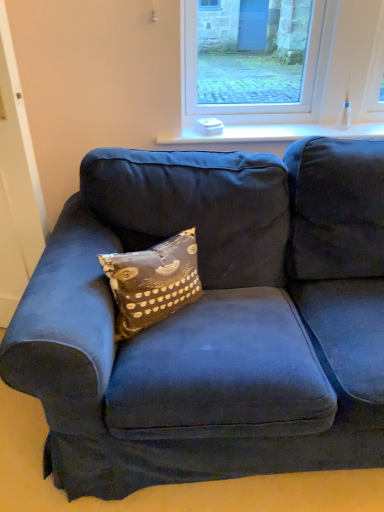
The image size is (384, 512). What do you see at coordinates (271, 134) in the screenshot?
I see `white glossy window sill at upper center` at bounding box center [271, 134].

Image resolution: width=384 pixels, height=512 pixels. Describe the element at coordinates (153, 282) in the screenshot. I see `brown printed cushion at center` at that location.

Identify the location of white glossy window sill at upper center. (271, 134).

From the image's perspective, is brown printed cushion at center on white glossy window sill at upper center?

No, from the image's perspective, brown printed cushion at center is not above white glossy window sill at upper center.

Can white glossy window sill at upper center be found inside brown printed cushion at center?

No.

Based on the photo, from their relative heights in the image, would you say brown printed cushion at center is taller or shorter than white glossy window sill at upper center?

Clearly, brown printed cushion at center is taller compared to white glossy window sill at upper center.

You are a GUI agent. You are given a task and a screenshot of the screen. Output one action in this format:
    pyautogui.click(x=<x>, y=<y>)
    Task: Click on the pillow below the white glossy window sill at upper center (from the image's perspective)
    
    Given the screenshot: What is the action you would take?
    (x=153, y=282)

Looking at this image, which is correct: white glossy window sill at upper center is inside clear glass window at upper center, or outside of it?

white glossy window sill at upper center is located beyond the bounds of clear glass window at upper center.

The width and height of the screenshot is (384, 512). In order to click on window above the white glossy window sill at upper center (from a real-world perspective) in this screenshot , I will do `click(256, 65)`.

Does white glossy window sill at upper center have a larger size compared to clear glass window at upper center?

Incorrect, white glossy window sill at upper center is not larger than clear glass window at upper center.

In terms of height, does white glossy window sill at upper center look taller or shorter compared to clear glass window at upper center?

Clearly, white glossy window sill at upper center is shorter compared to clear glass window at upper center.

Is clear glass window at upper center directly adjacent to brown printed cushion at center?

No, clear glass window at upper center is not beside brown printed cushion at center.

Considering the sizes of clear glass window at upper center and brown printed cushion at center in the image, is clear glass window at upper center wider or thinner than brown printed cushion at center?

Clearly, clear glass window at upper center has less width compared to brown printed cushion at center.

Can brown printed cushion at center be found inside clear glass window at upper center?

No.

Identify the location of window located above the brown printed cushion at center (from a real-world perspective). The image size is (384, 512). (256, 65).

Does brown printed cushion at center have a lesser height compared to clear glass window at upper center?

Indeed, brown printed cushion at center has a lesser height compared to clear glass window at upper center.

From a real-world perspective, is brown printed cushion at center beneath clear glass window at upper center?

Indeed, from a real-world perspective, brown printed cushion at center is positioned beneath clear glass window at upper center.

In the scene shown: Is brown printed cushion at center next to clear glass window at upper center and touching it?

brown printed cushion at center is not next to clear glass window at upper center, and they're not touching.

Is clear glass window at upper center at the back of brown printed cushion at center?

No, brown printed cushion at center's orientation is not away from clear glass window at upper center.

How many degrees apart are the facing directions of clear glass window at upper center and white glossy window sill at upper center?

0.806 degrees separate the facing orientations of clear glass window at upper center and white glossy window sill at upper center.

Considering the sizes of clear glass window at upper center and white glossy window sill at upper center in the image, is clear glass window at upper center taller or shorter than white glossy window sill at upper center?

In the image, clear glass window at upper center appears to be taller than white glossy window sill at upper center.

There is a white glossy window sill at upper center. In order to click on window above it (from a real-world perspective) in this screenshot , I will do `click(256, 65)`.

From a real-world perspective, who is located lower, clear glass window at upper center or white glossy window sill at upper center?

white glossy window sill at upper center, from a real-world perspective.

From the image's perspective, which is below, white glossy window sill at upper center or brown printed cushion at center?

brown printed cushion at center appears lower in the image.

In the scene shown: Does white glossy window sill at upper center lie behind brown printed cushion at center?

That is True.

In terms of height, does white glossy window sill at upper center look taller or shorter compared to brown printed cushion at center?

In the image, white glossy window sill at upper center appears to be shorter than brown printed cushion at center.

From a real-world perspective, is white glossy window sill at upper center below brown printed cushion at center?

No, from a real-world perspective, white glossy window sill at upper center is not under brown printed cushion at center.

This screenshot has width=384, height=512. I want to click on pillow beneath the white glossy window sill at upper center (from a real-world perspective), so click(x=153, y=282).

I want to click on window sill that is behind the clear glass window at upper center, so click(271, 134).

In the scene shown: Based on their spatial positions, is brown printed cushion at center or white glossy window sill at upper center further from clear glass window at upper center?

brown printed cushion at center lies further to clear glass window at upper center than the other object.

Based on their spatial positions, is white glossy window sill at upper center or clear glass window at upper center closer to brown printed cushion at center?

Based on the image, white glossy window sill at upper center appears to be nearer to brown printed cushion at center.

From the picture: Estimate the real-world distances between objects in this image. Which object is closer to white glossy window sill at upper center, clear glass window at upper center or brown printed cushion at center?

clear glass window at upper center is positioned closer to the anchor white glossy window sill at upper center.

From the image, which object appears to be farther from white glossy window sill at upper center, brown printed cushion at center or clear glass window at upper center?

Based on the image, brown printed cushion at center appears to be further to white glossy window sill at upper center.

Looking at the image, which one is located closer to clear glass window at upper center, white glossy window sill at upper center or brown printed cushion at center?

Based on the image, white glossy window sill at upper center appears to be nearer to clear glass window at upper center.

Estimate the real-world distances between objects in this image. Which object is further from brown printed cushion at center, clear glass window at upper center or white glossy window sill at upper center?

The object further to brown printed cushion at center is clear glass window at upper center.

Locate an element on the screen. window sill between clear glass window at upper center and brown printed cushion at center from top to bottom is located at coordinates (271, 134).